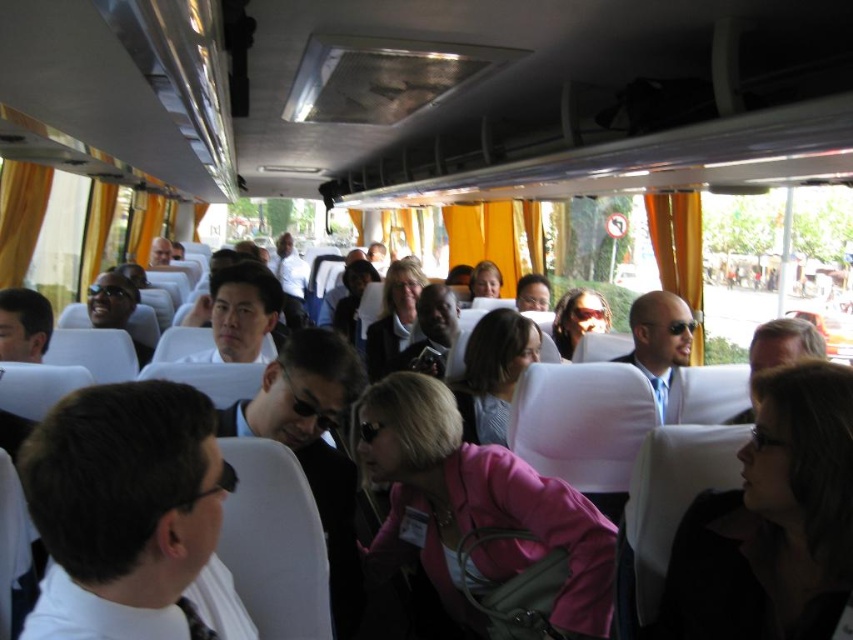
Between white shirt at center and pink fabric jacket at center, which one is positioned lower?

white shirt at center is below.

Can you confirm if white shirt at center is positioned below pink fabric jacket at center?

Yes.

Where is `white shirt at center`? Image resolution: width=853 pixels, height=640 pixels. white shirt at center is located at coordinates (123, 508).

Does pink fabric jacket at lower right have a greater width compared to smooth black suit at center?

No, pink fabric jacket at lower right is not wider than smooth black suit at center.

Measure the distance between point (x=839, y=563) and camera.

3.73 feet

Find the location of a particular element. Image resolution: width=853 pixels, height=640 pixels. pink fabric jacket at lower right is located at coordinates (772, 522).

Can you confirm if white shirt at center is bigger than pink matte jacket at center?

Incorrect, white shirt at center is not larger than pink matte jacket at center.

Does white shirt at center appear on the right side of pink matte jacket at center?

In fact, white shirt at center is to the left of pink matte jacket at center.

Does point (73, 429) come closer to viewer compared to point (503, 545)?

Yes.

At what (x,y) coordinates should I click in order to perform the action: click on white shirt at center. Please return your answer as a coordinate pair (x, y). The image size is (853, 640). Looking at the image, I should click on (123, 508).